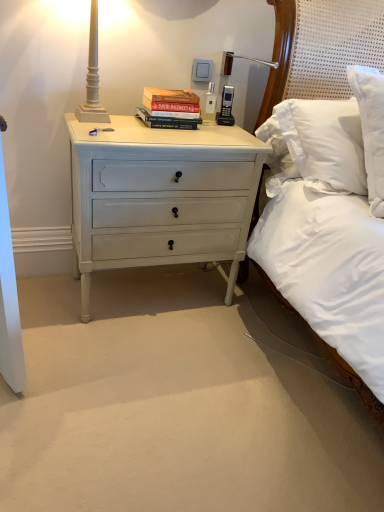
The width and height of the screenshot is (384, 512). In order to click on free location to the right of hardcover books at center in this screenshot , I will do click(222, 130).